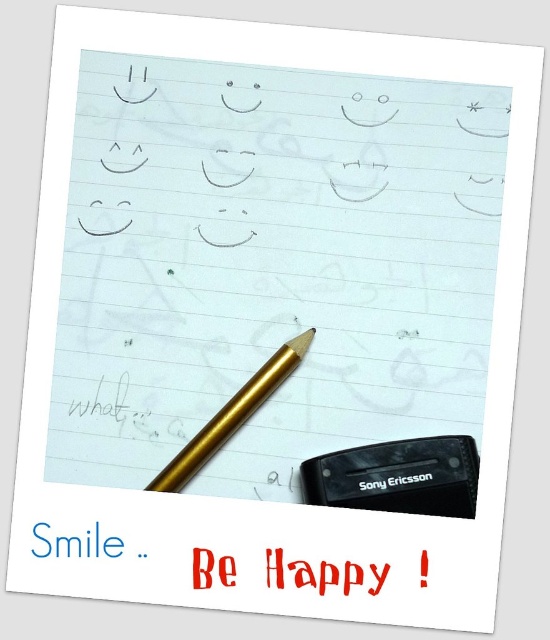
Question: Can you confirm if black plastic eraser at bottom right is bigger than red plastic text at center?

Choices:
 (A) yes
 (B) no

Answer: (A)

Question: Does black plastic eraser at bottom right come behind red plastic text at center?

Choices:
 (A) yes
 (B) no

Answer: (A)

Question: Is gold metallic pencil at center below red plastic text at center?

Choices:
 (A) yes
 (B) no

Answer: (B)

Question: Which point is closer to the camera?

Choices:
 (A) gold metallic pencil at center
 (B) red plastic text at center

Answer: (B)

Question: Which object appears closest to the camera in this image?

Choices:
 (A) red plastic text at center
 (B) black plastic eraser at bottom right

Answer: (A)

Question: Among these points, which one is farthest from the camera?

Choices:
 (A) (228, 400)
 (B) (437, 451)
 (C) (360, 576)

Answer: (A)